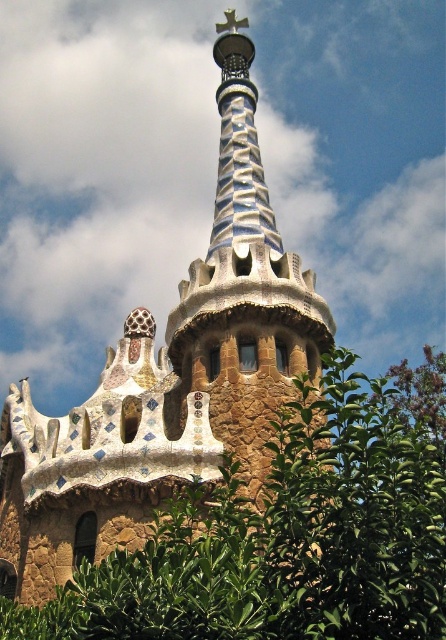
You are standing in front of the architectural structure at Park Gell and see two points marked on the spire. Which point is closer to you, point (297, 595) or point (255, 317)?

Point (297, 595) is closer to you than point (255, 317).

You are standing in front of the architectural structure and want to take a photo of the multicolored mosaic tower at center without the green leafy tree at center blocking it. Where should you move to achieve this?

The green leafy tree at center is in front of the multicolored mosaic tower at center, so you should move to a position where the tree is no longer between you and the tower. Moving to the side or behind the tree would allow you to capture the tower without obstruction.